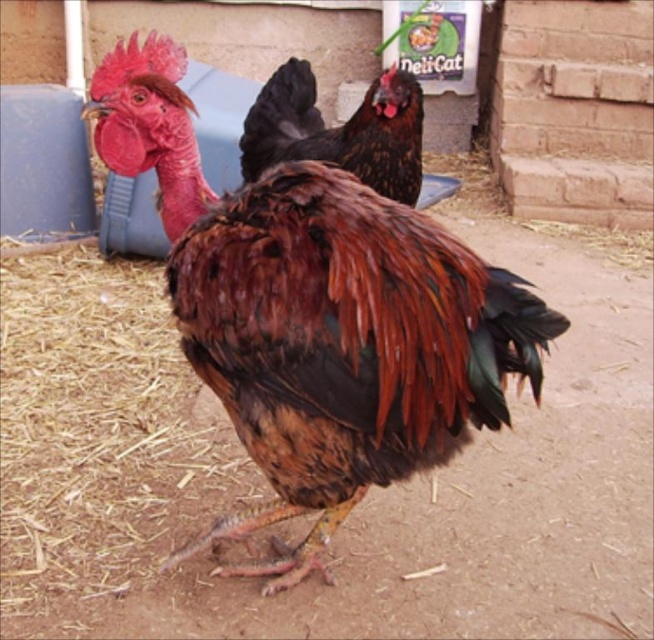
Question: Can you confirm if brown feathered chicken at center is wider than shiny black feathers at center?

Choices:
 (A) no
 (B) yes

Answer: (B)

Question: Among these points, which one is farthest from the camera?

Choices:
 (A) (439, 307)
 (B) (294, 84)

Answer: (B)

Question: Does brown feathered chicken at center have a larger size compared to shiny black feathers at center?

Choices:
 (A) no
 (B) yes

Answer: (B)

Question: Among these points, which one is farthest from the camera?

Choices:
 (A) (400, 396)
 (B) (407, 172)

Answer: (B)

Question: Is brown feathered chicken at center to the right of shiny black feathers at center from the viewer's perspective?

Choices:
 (A) no
 (B) yes

Answer: (A)